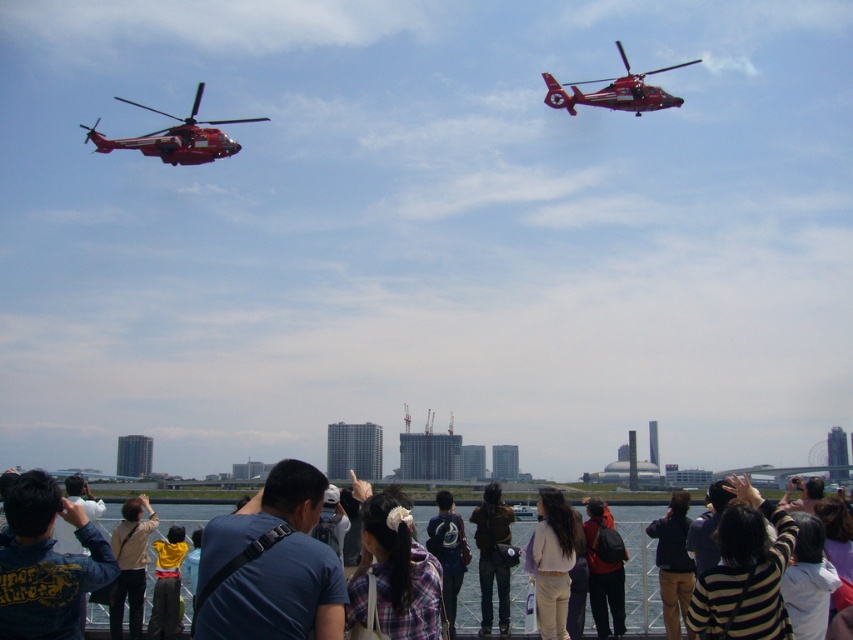
You are a photographer trying to capture the two red helicopters flying overhead. You notice a light brown leather jacket at lower left and a yellow fabric at center in your frame. Which object is wider in the image?

The light brown leather jacket at lower left is wider than the yellow fabric at center.

You are a photographer trying to capture a photo of the two red helicopters. You notice a person wearing a blue fabric shirt at center and a person in a denim jacket at lower left. Which person is standing more to the right side of the other?

The blue fabric shirt at center is positioned on the right side of denim jacket at lower left, so the person in the blue fabric shirt at center is standing more to the right.

You are a photographer trying to capture a clear shot of the yellow fabric at center. There is a person wearing a light brown leather jacket at lower left in the way. Based on their positions, can you adjust your camera angle to avoid the jacket?

The light brown leather jacket at lower left is positioned on the left side of yellow fabric at center. To avoid the jacket, move your camera to the right side of the yellow fabric at center.